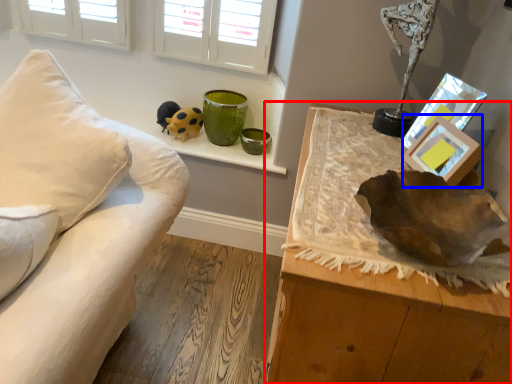
Question: Which object appears closest to the camera in this image, table (highlighted by a red box) or picture frame (highlighted by a blue box)?

Choices:
 (A) table
 (B) picture frame

Answer: (A)